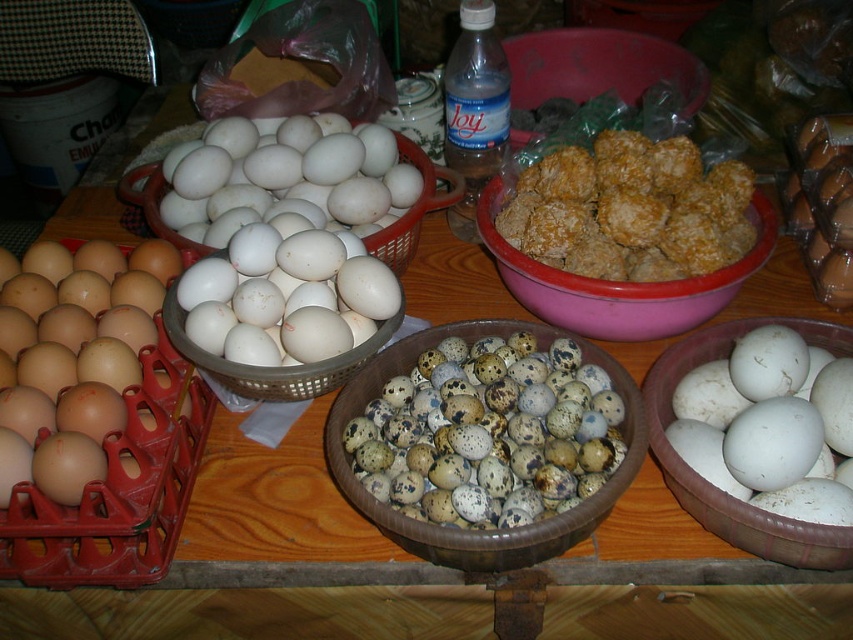
Consider the image. Can you confirm if brown crumbly balls at center is shorter than matte pink bowl at center?

Yes, brown crumbly balls at center is shorter than matte pink bowl at center.

The image size is (853, 640). Identify the location of brown crumbly balls at center. (630, 209).

Looking at this image, who is positioned more to the left, white matte eggs at center or brown crumbly balls at center?

Positioned to the left is white matte eggs at center.

Locate an element on the screen. The height and width of the screenshot is (640, 853). white matte eggs at center is located at coordinates (289, 252).

What do you see at coordinates (289, 252) in the screenshot?
I see `white matte eggs at center` at bounding box center [289, 252].

The height and width of the screenshot is (640, 853). What are the coordinates of `white matte eggs at center` in the screenshot? It's located at (289, 252).

Does brown matte egg at left have a greater width compared to matte pink bowl at center?

No, brown matte egg at left is not wider than matte pink bowl at center.

Does brown matte egg at left appear on the right side of matte pink bowl at center?

Incorrect, brown matte egg at left is not on the right side of matte pink bowl at center.

Who is more forward, (86, 404) or (689, 300)?

Point (86, 404) is in front.

Where is `brown matte egg at left`? This screenshot has width=853, height=640. brown matte egg at left is located at coordinates (71, 356).